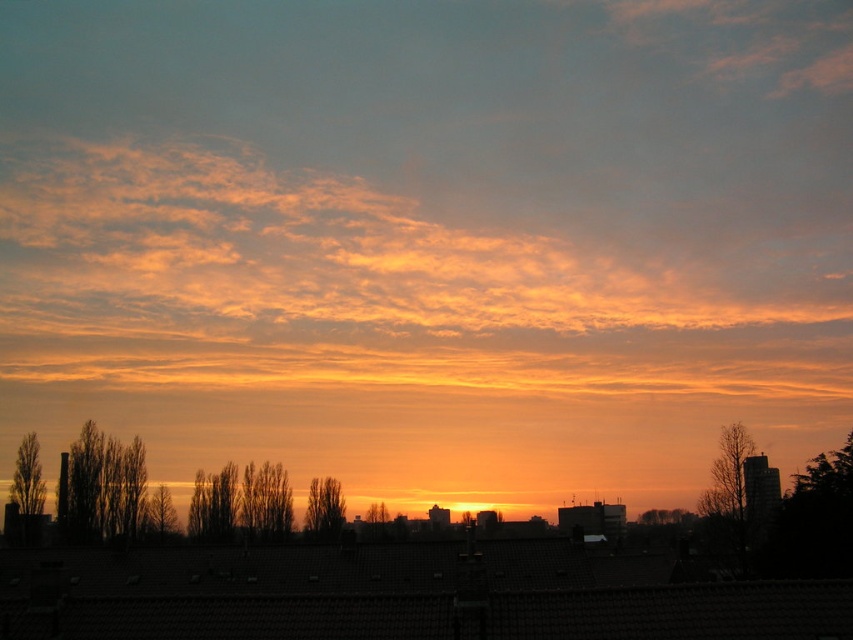
Who is higher up, bare branches at right or green leafy tree at center?

bare branches at right is above.

Locate an element on the screen. bare branches at right is located at coordinates (729, 474).

This screenshot has height=640, width=853. What do you see at coordinates (729, 474) in the screenshot? I see `bare branches at right` at bounding box center [729, 474].

You are a GUI agent. You are given a task and a screenshot of the screen. Output one action in this format:
    pyautogui.click(x=<x>, y=<y>)
    Task: Click on the bare branches at right
    
    Given the screenshot: What is the action you would take?
    pyautogui.click(x=729, y=474)

Does brown textured tree at left have a lesser height compared to green matte tree at center?

In fact, brown textured tree at left may be taller than green matte tree at center.

Does brown textured tree at left have a greater width compared to green matte tree at center?

In fact, brown textured tree at left might be narrower than green matte tree at center.

Is point (39, 483) positioned after point (665, 509)?

That is False.

Find the location of a particular element. brown textured tree at left is located at coordinates (27, 477).

Does bare branches at right have a larger size compared to brown matte tree at left?

Yes, bare branches at right is bigger than brown matte tree at left.

Consider the image. Between bare branches at right and brown matte tree at left, which one has more height?

With more height is bare branches at right.

Where is `bare branches at right`? bare branches at right is located at coordinates (729, 474).